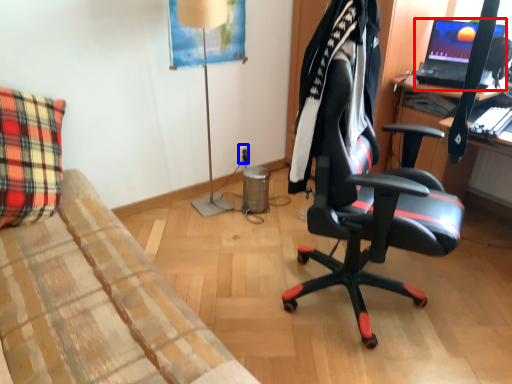
Question: Among these objects, which one is nearest to the camera, laptop (highlighted by a red box) or power outlet (highlighted by a blue box)?

Choices:
 (A) laptop
 (B) power outlet

Answer: (A)